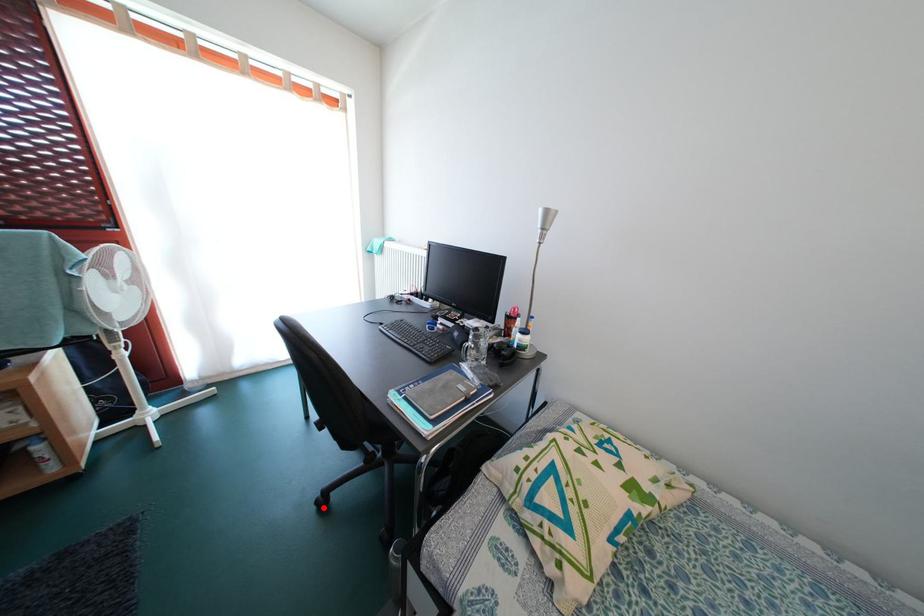
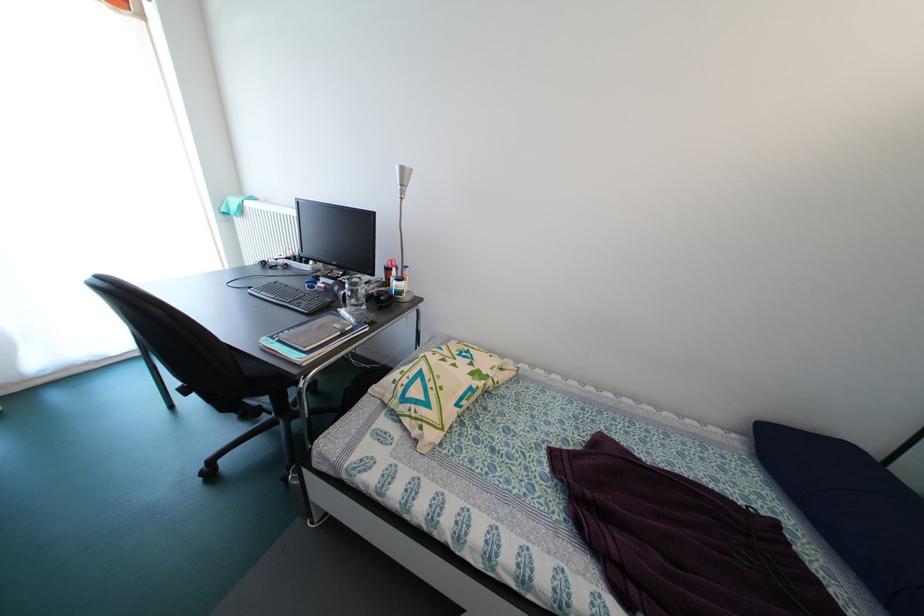
The point at the highlighted location is marked in the first image. Where is the corresponding point in the second image?

(209, 479)